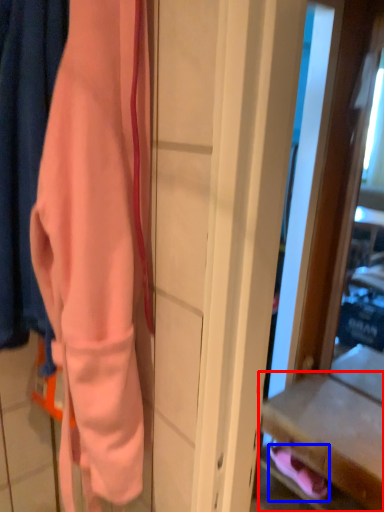
Question: Which point is closer to the camera, drawer (highlighted by a red box) or footwear (highlighted by a blue box)?

Choices:
 (A) drawer
 (B) footwear

Answer: (A)